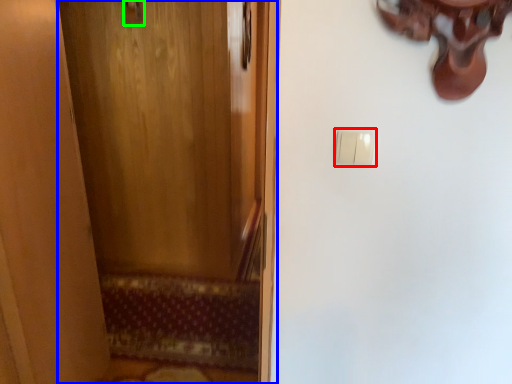
Question: Considering the real-world distances, which object is farthest from light switch (highlighted by a red box)? door (highlighted by a blue box) or door handle (highlighted by a green box)?

Choices:
 (A) door
 (B) door handle

Answer: (A)